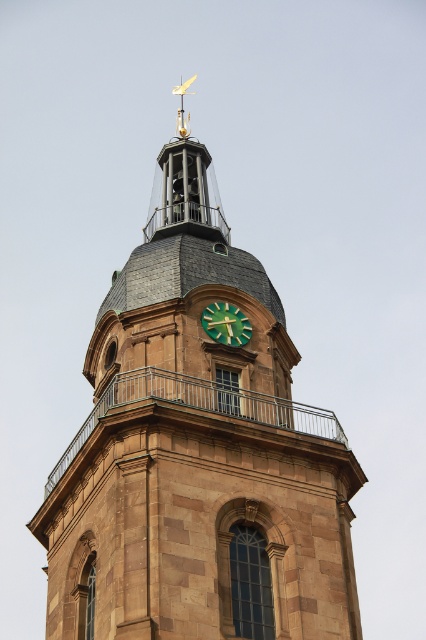
Question: Does brown stone clock tower at center appear on the left side of green matte clock at center?

Choices:
 (A) yes
 (B) no

Answer: (A)

Question: Among these points, which one is nearest to the camera?

Choices:
 (A) 201,637
 (B) 180,100
 (C) 218,308

Answer: (A)

Question: Can you confirm if brown stone clock tower at center is positioned to the left of green matte clock at center?

Choices:
 (A) yes
 (B) no

Answer: (A)

Question: Estimate the real-world distances between objects in this image. Which object is closer to the gold-plated weather vane at top?

Choices:
 (A) green matte clock at center
 (B) brown stone clock tower at center

Answer: (B)

Question: Which object appears farthest from the camera in this image?

Choices:
 (A) green matte clock at center
 (B) gold-plated weather vane at top
 (C) brown stone clock tower at center

Answer: (B)

Question: Can you confirm if brown stone clock tower at center is positioned above gold-plated weather vane at top?

Choices:
 (A) yes
 (B) no

Answer: (B)